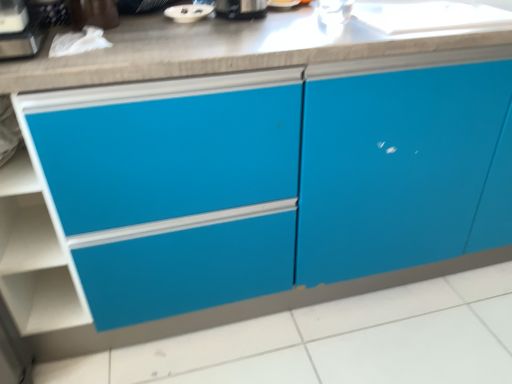
At what (x,y) coordinates should I click in order to perform the action: click on free point in front of white glossy bowl at upper center. Please return your answer as a coordinate pair (x, y). The image size is (512, 384). Looking at the image, I should click on (192, 40).